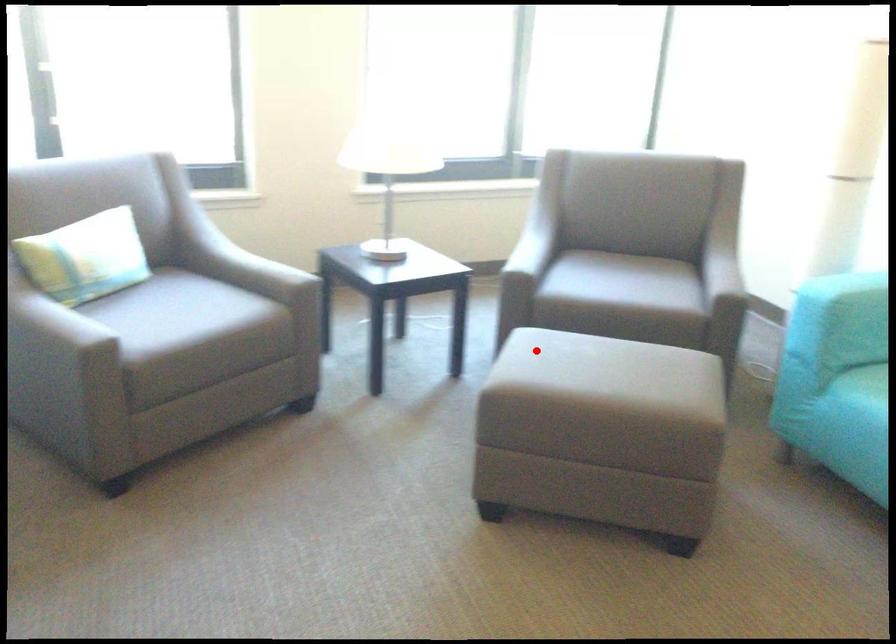
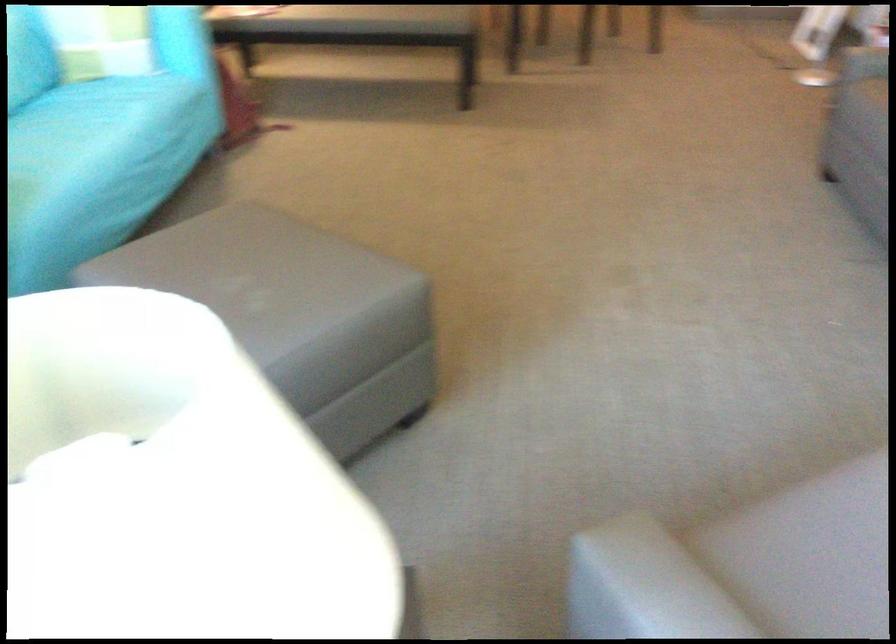
The point at the highlighted location is marked in the first image. Where is the corresponding point in the second image?

(282, 296)